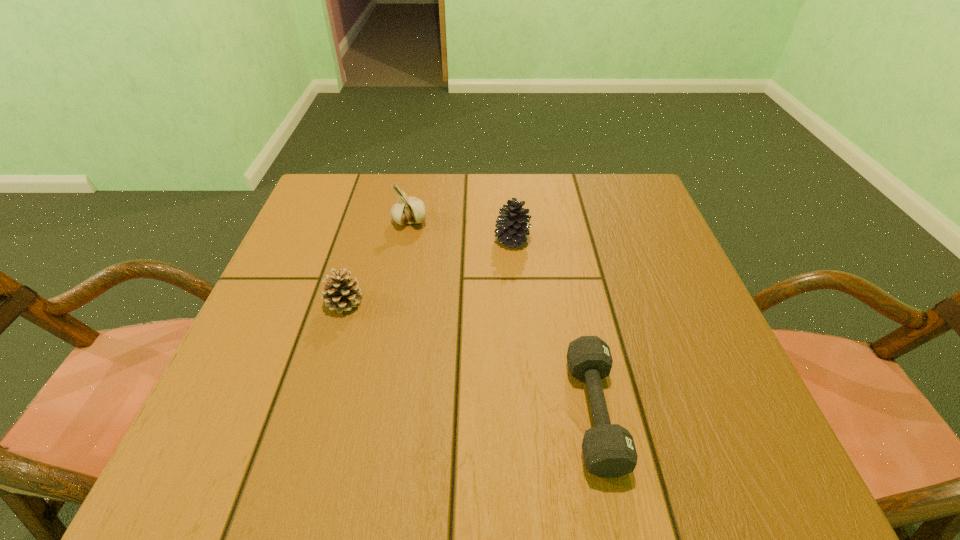
Where is `the right pinecone`? This screenshot has height=540, width=960. the right pinecone is located at coordinates (513, 223).

Identify the location of the taller pinecone. The width and height of the screenshot is (960, 540). (513, 223).

You are a GUI agent. You are given a task and a screenshot of the screen. Output one action in this format:
    pyautogui.click(x=<x>, y=<y>)
    Task: Click on the garlic
    
    Given the screenshot: What is the action you would take?
    pyautogui.click(x=407, y=210)

Where is `the shorter pinecone`? the shorter pinecone is located at coordinates (341, 294).

The width and height of the screenshot is (960, 540). Identify the location of the third farthest object. (341, 294).

Identify the location of dumbbell. Image resolution: width=960 pixels, height=540 pixels. (608, 449).

The image size is (960, 540). What are the coordinates of `the shortest object` in the screenshot? It's located at (608, 449).

Image resolution: width=960 pixels, height=540 pixels. Identify the location of blank space located on the left of the taller pinecone. (464, 239).

Locate an element on the screen. The width and height of the screenshot is (960, 540). vacant space located 0.100m on the front of the garlic is located at coordinates (402, 260).

Locate an element on the screen. The width and height of the screenshot is (960, 540). free space located 0.220m on the front of the leftmost object is located at coordinates (308, 423).